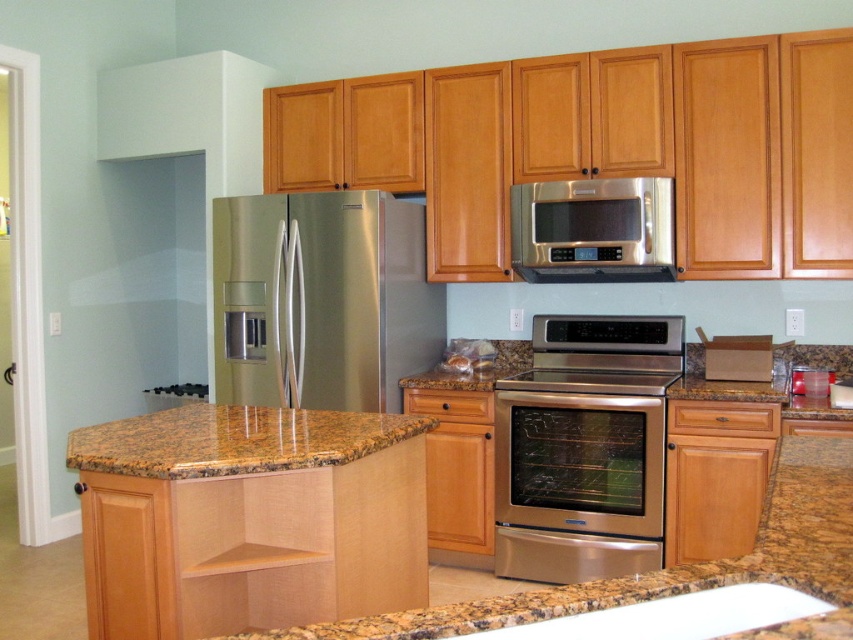
You are a kitchen designer and need to install a new ventilation system that requires a minimum of 30 inches between the oven and microwave. Based on the current setup, will the existing space between the stainless steel oven at center and the stainless steel microwave at upper center allow for this installation?

The stainless steel oven at center and stainless steel microwave at upper center are 28.25 inches apart from each other, which is less than the required 30 inches. Therefore, the existing space is insufficient for the ventilation system installation.

You are a kitchen designer planning to install a new appliance. You have a white matte exhaust hood at upper left and a brown granite sink at lower center in the kitchen. Which of these two objects is taller?

The white matte exhaust hood at upper left is taller than the brown granite sink at lower center.

You are a kitchen designer planning to install a new appliance between the stainless steel microwave at upper center and the brown granite sink at lower center. The appliance requires a minimum of 8 feet of space between them. Can you confirm if there is enough space?

The stainless steel microwave at upper center is 8.29 feet away from the brown granite sink at lower center, which is more than the required 8 feet. Therefore, there is sufficient space to install the appliance between them.